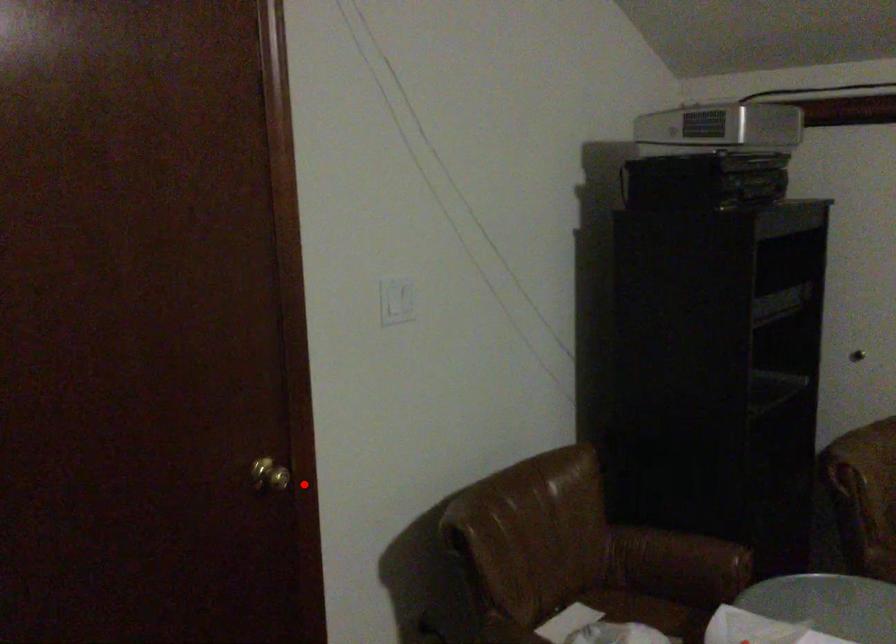
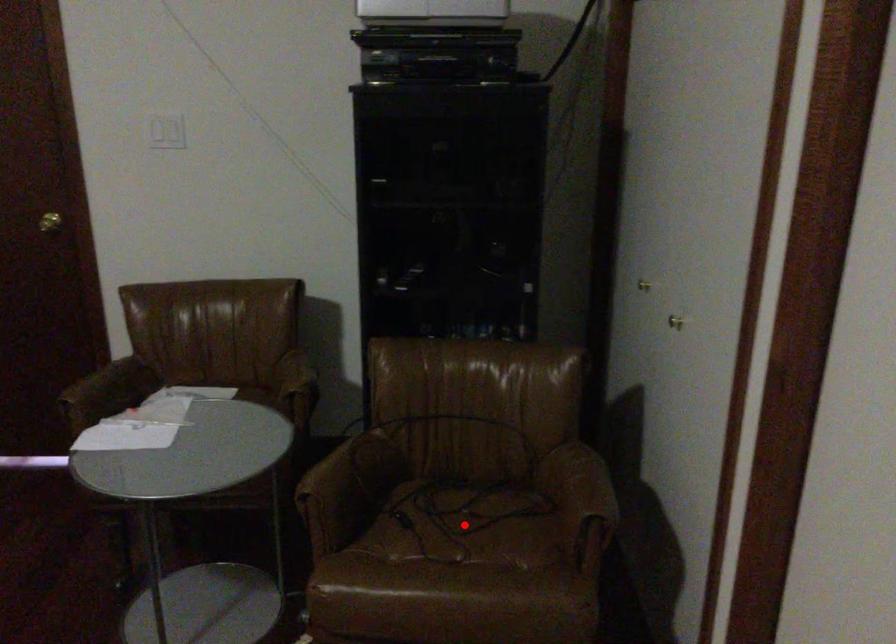
Consider the image. I am providing you with two images of the same scene from different viewpoints. A red point is marked on the first image and another point is marked on the second image. Is the red point in image1 aligned with the point shown in image2?

No